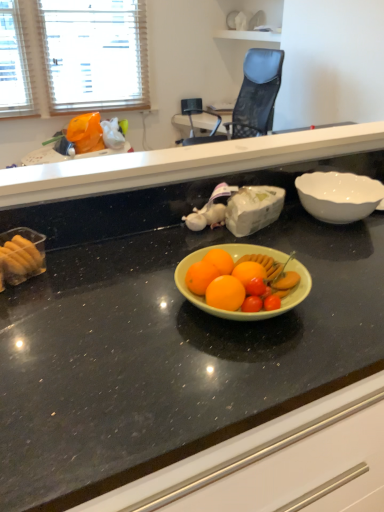
Question: Does black granite countertop at center, the first countertop positioned from the top, have a smaller size compared to white glossy bowl at right?

Choices:
 (A) yes
 (B) no

Answer: (B)

Question: From the image's perspective, is black granite countertop at center, the first countertop positioned from the top, under white glossy bowl at right?

Choices:
 (A) yes
 (B) no

Answer: (B)

Question: From a real-world perspective, is black granite countertop at center, the first countertop positioned from the top, physically below white glossy bowl at right?

Choices:
 (A) yes
 (B) no

Answer: (B)

Question: Would you consider black granite countertop at center, the first countertop positioned from the top, to be distant from white glossy bowl at right?

Choices:
 (A) yes
 (B) no

Answer: (B)

Question: Considering the relative sizes of black granite countertop at center, the 2th countertop when ordered from bottom to top, and white glossy bowl at right in the image provided, is black granite countertop at center, the 2th countertop when ordered from bottom to top, taller than white glossy bowl at right?

Choices:
 (A) no
 (B) yes

Answer: (B)

Question: Is black granite countertop at center, the first countertop positioned from the top, inside the boundaries of white glossy bowl at right, or outside?

Choices:
 (A) inside
 (B) outside

Answer: (B)

Question: Considering the positions of point (288, 140) and point (337, 202), is point (288, 140) closer or farther from the camera than point (337, 202)?

Choices:
 (A) closer
 (B) farther

Answer: (B)

Question: From a real-world perspective, is black granite countertop at center, the first countertop positioned from the top, above or below white glossy bowl at right?

Choices:
 (A) above
 (B) below

Answer: (A)

Question: From the image's perspective, is black granite countertop at center, the 2th countertop when ordered from bottom to top, above or below white glossy bowl at right?

Choices:
 (A) below
 (B) above

Answer: (B)

Question: Is white glossy bowl at right to the left or to the right of black granite countertop at center, the first countertop positioned from the top, in the image?

Choices:
 (A) right
 (B) left

Answer: (A)

Question: Which is correct: white glossy bowl at right is inside black granite countertop at center, the first countertop positioned from the top, or outside of it?

Choices:
 (A) inside
 (B) outside

Answer: (B)

Question: From the image's perspective, is white glossy bowl at right located above or below black granite countertop at center, the first countertop positioned from the top?

Choices:
 (A) above
 (B) below

Answer: (B)

Question: Considering their positions, is white glossy bowl at right located in front of or behind black granite countertop at center, the first countertop positioned from the top?

Choices:
 (A) behind
 (B) front

Answer: (A)

Question: From a real-world perspective, is white glossy bowl at right positioned above or below blue mesh chair at upper center?

Choices:
 (A) below
 (B) above

Answer: (B)

Question: Looking at their shapes, would you say white glossy bowl at right is wider or thinner than blue mesh chair at upper center?

Choices:
 (A) wide
 (B) thin

Answer: (B)